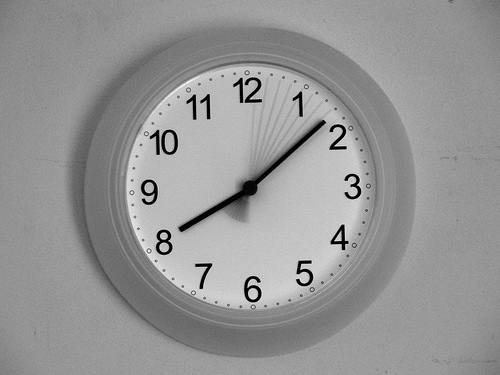
The height and width of the screenshot is (375, 500). I want to click on clock hands, so click(244, 188).